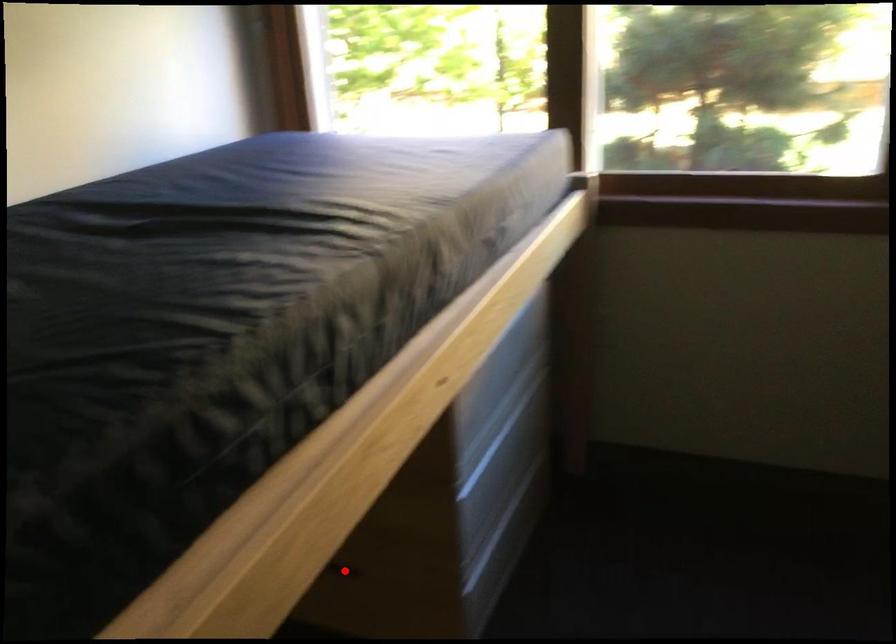
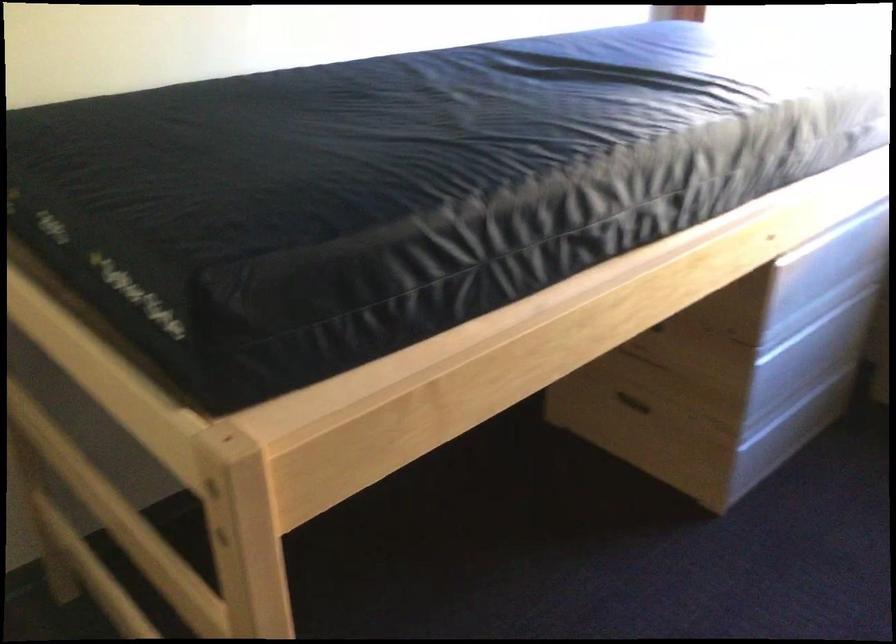
Question: I am providing you with two images of the same scene from different viewpoints. Given a red point in image1, look at the same physical point in image2. Is it:

Choices:
 (A) Closer to the viewpoint
 (B) Farther from the viewpoint

Answer: (B)